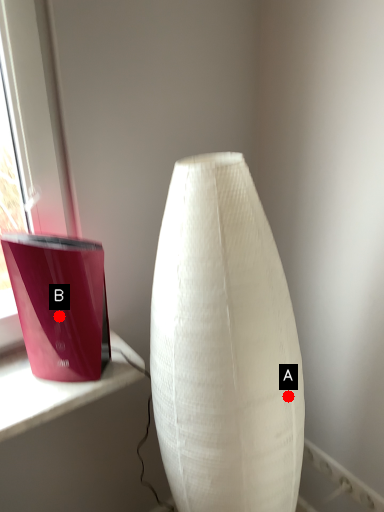
Question: Two points are circled on the image, labeled by A and B beside each circle. Among these points, which one is nearest to the camera?

Choices:
 (A) A is closer
 (B) B is closer

Answer: (A)